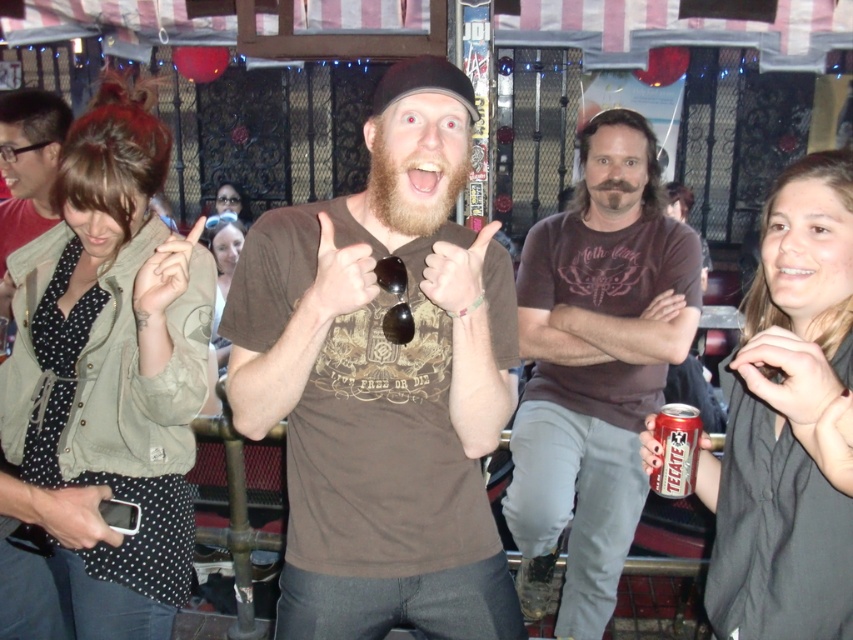
Is brown cotton t-shirt at center closer to the viewer compared to matte black jacket at center?

That is True.

The height and width of the screenshot is (640, 853). In order to click on brown cotton t-shirt at center in this screenshot , I will do `click(595, 369)`.

Who is higher up, brown matte t-shirt at center or green textured jacket at left?

brown matte t-shirt at center is higher up.

Looking at this image, between brown matte t-shirt at center and green textured jacket at left, which one has less height?

Standing shorter between the two is brown matte t-shirt at center.

Which is in front, point (428, 518) or point (149, 630)?

Point (428, 518) is more forward.

Identify the location of brown matte t-shirt at center. (383, 381).

Can you confirm if matte black shirt at center is positioned below matte black jacket at center?

Indeed, matte black shirt at center is positioned under matte black jacket at center.

At what (x,y) coordinates should I click in order to perform the action: click on matte black shirt at center. Please return your answer as a coordinate pair (x, y). Looking at the image, I should click on (788, 422).

This screenshot has width=853, height=640. Identify the location of matte black shirt at center. (788, 422).